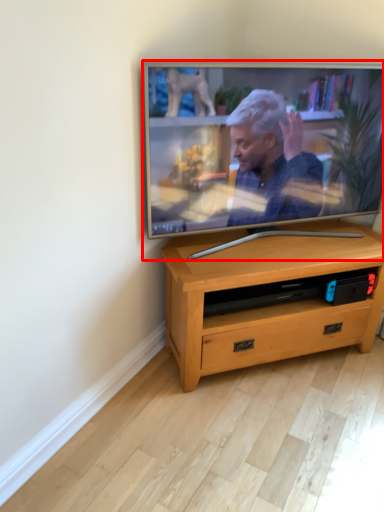
Question: From the image, what is the correct spatial relationship of television (annotated by the red box) in relation to desk?

Choices:
 (A) right
 (B) left

Answer: (B)